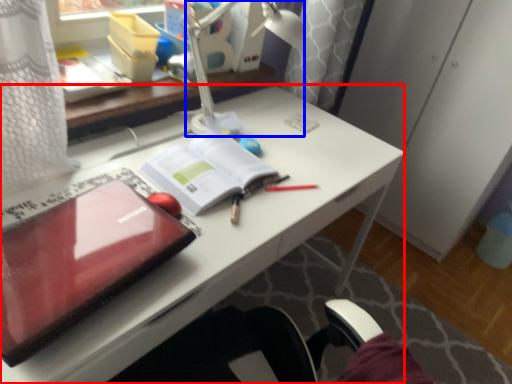
Question: Which object appears closest to the camera in this image, desk (highlighted by a red box) or lamp (highlighted by a blue box)?

Choices:
 (A) desk
 (B) lamp

Answer: (A)